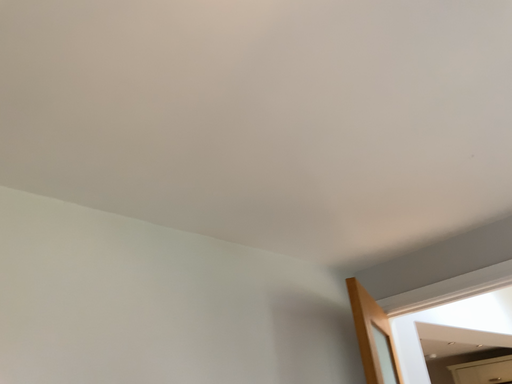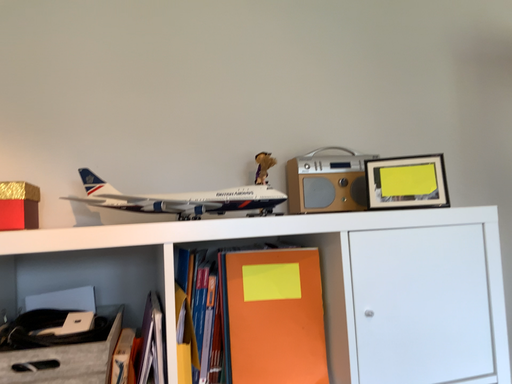
Question: How did the camera likely rotate when shooting the video?

Choices:
 (A) rotated downward
 (B) rotated upward

Answer: (A)